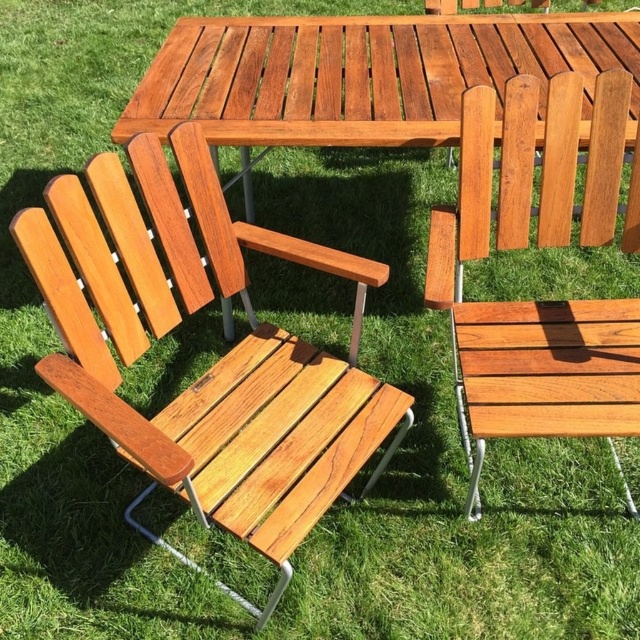
Question: Which is nearer to the natural wood chair at center?

Choices:
 (A) glossy wood picnic table at center
 (B) natural wood chair at left

Answer: (A)

Question: Is natural wood chair at left closer to camera compared to glossy wood picnic table at center?

Choices:
 (A) no
 (B) yes

Answer: (B)

Question: Which object appears farthest from the camera in this image?

Choices:
 (A) glossy wood picnic table at center
 (B) natural wood chair at left
 (C) natural wood chair at center

Answer: (A)

Question: Which point is farther to the camera?

Choices:
 (A) natural wood chair at left
 (B) glossy wood picnic table at center
 (C) natural wood chair at center

Answer: (B)

Question: Is natural wood chair at left below natural wood chair at center?

Choices:
 (A) no
 (B) yes

Answer: (B)

Question: Does natural wood chair at center have a larger size compared to glossy wood picnic table at center?

Choices:
 (A) no
 (B) yes

Answer: (A)